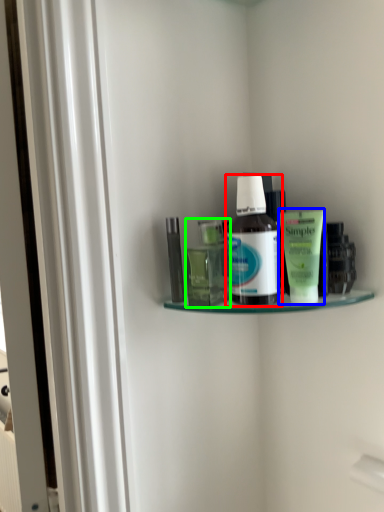
Question: Considering the real-world distances, which object is farthest from bottle (highlighted by a red box)? toiletry (highlighted by a blue box) or toiletry (highlighted by a green box)?

Choices:
 (A) toiletry
 (B) toiletry

Answer: (B)